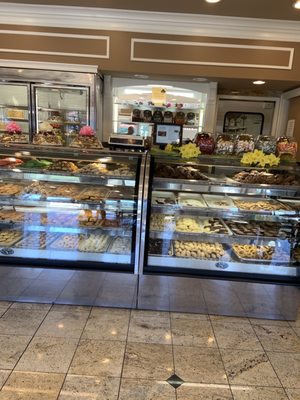
Find the location of `register`. register is located at coordinates (129, 140).